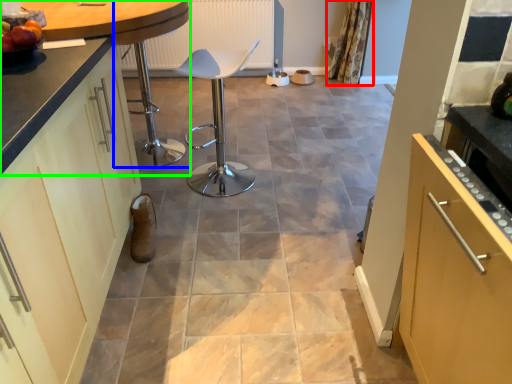
Question: Considering the real-world distances, which object is closest to curtain (highlighted by a red box)? bar stool (highlighted by a blue box) or countertop (highlighted by a green box).

Choices:
 (A) bar stool
 (B) countertop

Answer: (A)